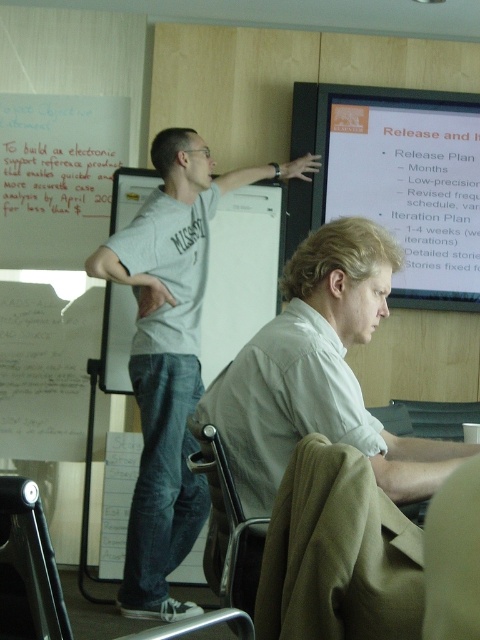
Question: Is white glossy projector screen at upper center smaller than white paper at upper left?

Choices:
 (A) no
 (B) yes

Answer: (A)

Question: Among these points, which one is nearest to the camera?

Choices:
 (A) (360, 173)
 (B) (207, 230)
 (C) (35, 170)

Answer: (B)

Question: Based on their relative distances, which object is farther from the white paper at upper left?

Choices:
 (A) white glossy projector screen at upper center
 (B) gray cotton shirt at upper center

Answer: (A)

Question: Is gray cotton shirt at upper center further to the viewer compared to white paper at upper left?

Choices:
 (A) yes
 (B) no

Answer: (B)

Question: Which point is closer to the camera taking this photo?

Choices:
 (A) (122, 157)
 (B) (361, 129)
 (C) (134, 260)

Answer: (C)

Question: Is white glossy projector screen at upper center positioned behind white paper at upper left?

Choices:
 (A) yes
 (B) no

Answer: (B)